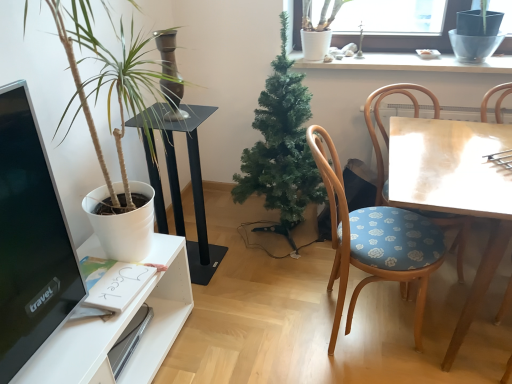
Image resolution: width=512 pixels, height=384 pixels. I want to click on vacant space in front of black glass table at center, so click(x=212, y=297).